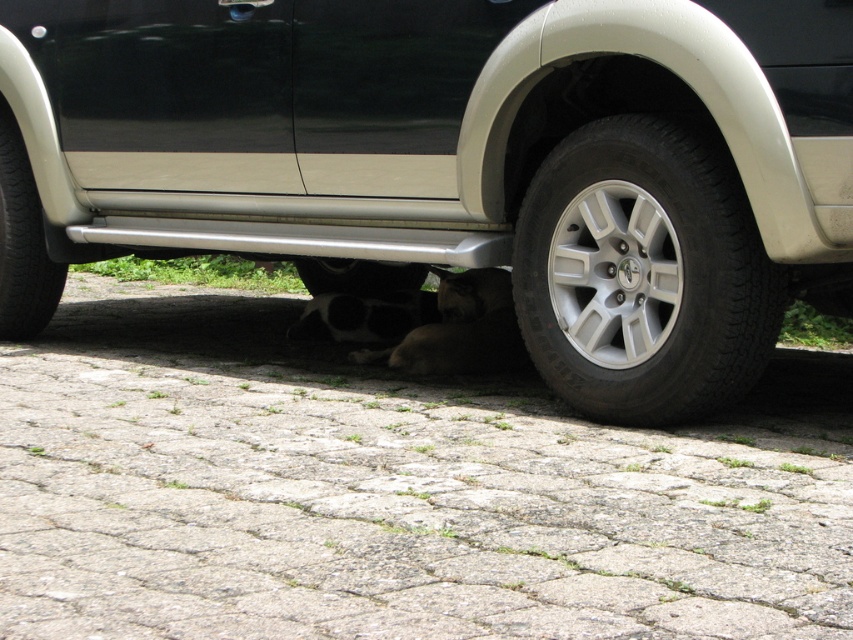
Question: Is silver metallic wheel at lower right behind black rubber tire at lower left?

Choices:
 (A) no
 (B) yes

Answer: (A)

Question: Among these objects, which one is farthest from the camera?

Choices:
 (A) black rubber tire at lower left
 (B) silver metallic wheel at lower right
 (C) black rubber tire at lower center
 (D) black matte car at lower center

Answer: (C)

Question: Where is silver metallic wheel at lower right located in relation to black rubber tire at lower left in the image?

Choices:
 (A) left
 (B) right

Answer: (B)

Question: Does black rubber tire at lower left appear on the left side of black rubber tire at lower center?

Choices:
 (A) yes
 (B) no

Answer: (A)

Question: Considering the real-world distances, which object is farthest from the black matte car at lower center?

Choices:
 (A) black rubber tire at lower left
 (B) silver metallic wheel at lower right
 (C) black rubber tire at lower center

Answer: (C)

Question: Which point appears farthest from the camera in this image?

Choices:
 (A) click(19, 230)
 (B) click(604, 300)
 (C) click(729, 125)

Answer: (A)